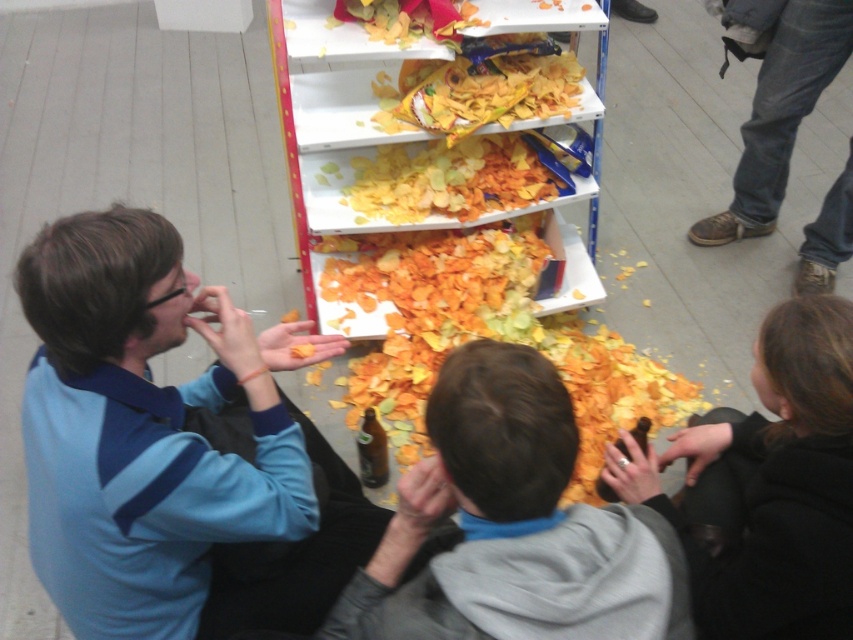
Who is higher up, denim jeans at right or yellow crispy chips at center?

denim jeans at right

Who is positioned more to the left, denim jeans at right or yellow crispy chips at center?

yellow crispy chips at center

Describe the element at coordinates (776, 102) in the screenshot. I see `denim jeans at right` at that location.

This screenshot has width=853, height=640. I want to click on denim jeans at right, so click(776, 102).

Between point (206, 528) and point (550, 83), which one is positioned behind?

The point (550, 83) is more distant.

Is blue fabric shirt at left positioned at the back of matte plastic chips at center?

No, blue fabric shirt at left is in front of matte plastic chips at center.

The image size is (853, 640). I want to click on blue fabric shirt at left, so click(172, 449).

Does crinkled paper chips at center have a greater width compared to yellow crispy chips at center?

Correct, the width of crinkled paper chips at center exceeds that of yellow crispy chips at center.

Looking at this image, between crinkled paper chips at center and yellow crispy chips at center, which one has less height?

With less height is yellow crispy chips at center.

Does point (418, 348) come closer to viewer compared to point (431, 176)?

No, (418, 348) is behind (431, 176).

You are a GUI agent. You are given a task and a screenshot of the screen. Output one action in this format:
    pyautogui.click(x=<x>, y=<y>)
    Task: Click on the crinkled paper chips at center
    The width and height of the screenshot is (853, 640).
    Given the screenshot: What is the action you would take?
    tap(488, 337)